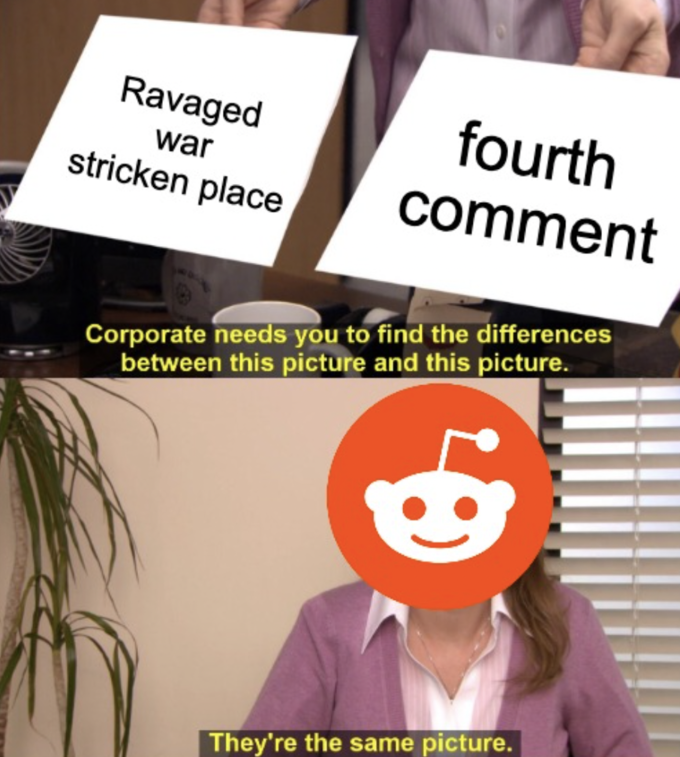
What are the coordinates of `coffee cup` in the screenshot? It's located at (239, 312).